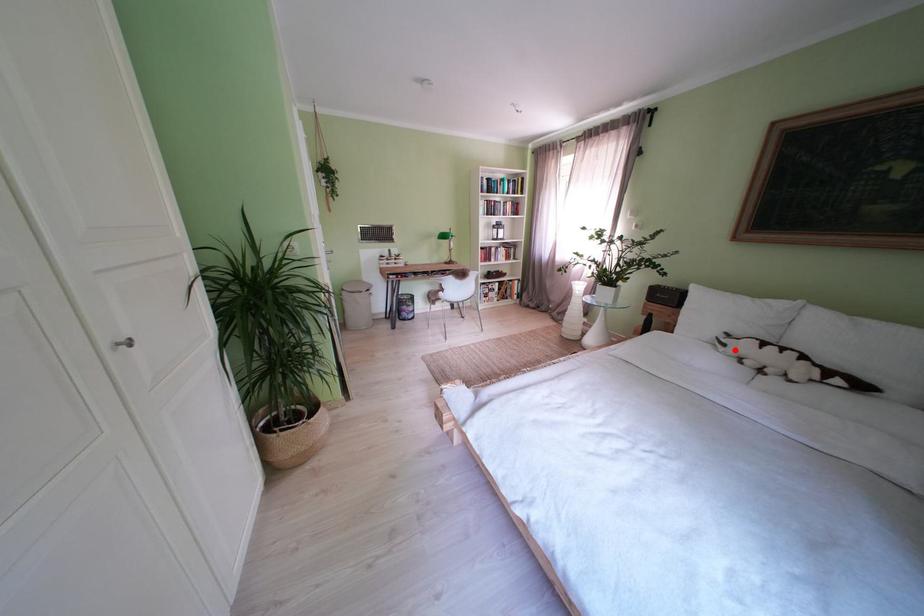
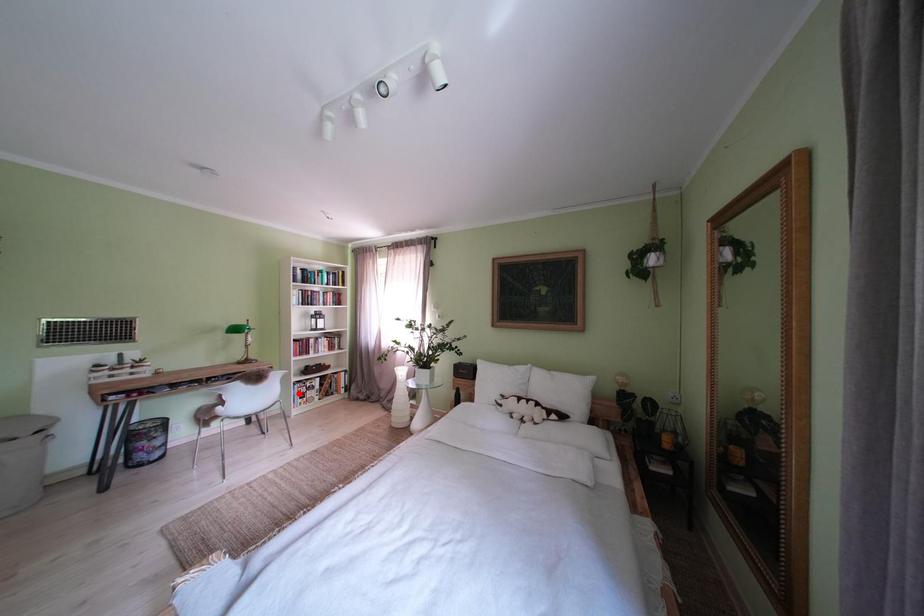
I am providing you with two images of the same scene from different viewpoints. A red point is marked on the first image and another point is marked on the second image. Does the point marked in image1 correspond to the same location as the one in image2?

No